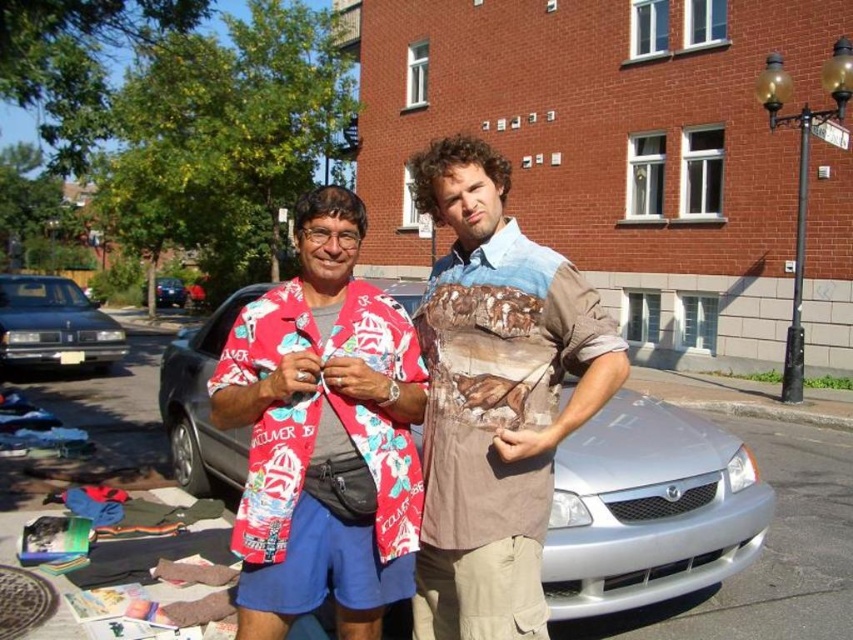
Can you confirm if floral fabric shirt at center is smaller than shiny black sedan at left?

Correct, floral fabric shirt at center occupies less space than shiny black sedan at left.

Who is lower down, floral fabric shirt at center or shiny black sedan at left?

floral fabric shirt at center is below.

Describe the element at coordinates (495, 397) in the screenshot. I see `floral fabric shirt at center` at that location.

Where is `floral fabric shirt at center`? The image size is (853, 640). floral fabric shirt at center is located at coordinates (495, 397).

Is matte black sedan at left above shiny black sedan at left?

Actually, matte black sedan at left is below shiny black sedan at left.

Who is higher up, matte black sedan at left or shiny black sedan at left?

shiny black sedan at left is higher up.

The width and height of the screenshot is (853, 640). What are the coordinates of `matte black sedan at left` in the screenshot? It's located at (54, 324).

What do you see at coordinates (323, 435) in the screenshot? I see `hawaiian fabric shirt at center` at bounding box center [323, 435].

Does hawaiian fabric shirt at center have a greater width compared to matte black sedan at left?

No, hawaiian fabric shirt at center is not wider than matte black sedan at left.

What do you see at coordinates (323, 435) in the screenshot? Image resolution: width=853 pixels, height=640 pixels. I see `hawaiian fabric shirt at center` at bounding box center [323, 435].

Locate an element on the screen. The width and height of the screenshot is (853, 640). hawaiian fabric shirt at center is located at coordinates (323, 435).